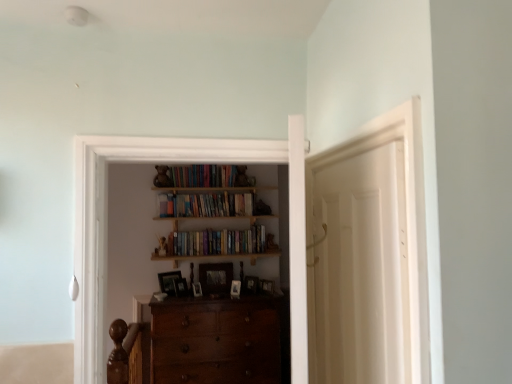
Question: From a real-world perspective, is woodenmaterial/texture entertainment center at center above or below wooden photo frame at center, arranged as the fifth picture frame when viewed from the right?

Choices:
 (A) below
 (B) above

Answer: (B)

Question: In terms of width, does woodenmaterial/texture entertainment center at center look wider or thinner when compared to wooden photo frame at center, arranged as the fifth picture frame when viewed from the right?

Choices:
 (A) thin
 (B) wide

Answer: (B)

Question: Considering the real-world distances, which object is farthest from the white matte door at center?

Choices:
 (A) brown polished wood chair at lower left
 (B) hardcover books at center, which is counted as the second book, starting from the top
 (C) wooden photo frame at center, arranged as the fifth picture frame when viewed from the right
 (D) wooden picture frame at center, the second picture frame positioned from the right
 (E) wooden picture frame at center, marked as the fifth picture frame in a left-to-right arrangement

Answer: (D)

Question: Considering the real-world distances, which object is closest to the wooden picture frame at center, which ranks as the first picture frame in right-to-left order?

Choices:
 (A) wooden bookshelf at upper center, acting as the second book starting from the bottom
 (B) hardcover books at center, which is counted as the second book, starting from the top
 (C) wooden photo frame at center, placed as the sixth picture frame when sorted from right to left
 (D) wooden photo frame at center, the third picture frame when ordered from left to right
 (E) wooden picture frame at center, the second picture frame positioned from the right

Answer: (E)